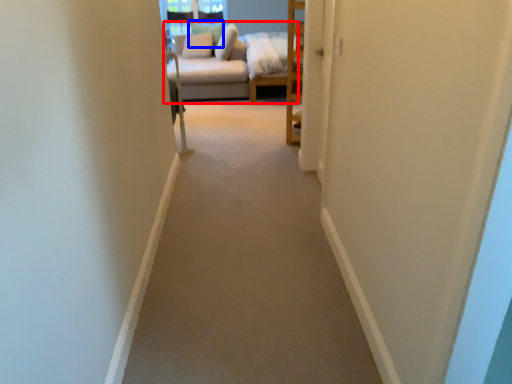
Question: Which object is closer to the camera taking this photo, studio couch (highlighted by a red box) or pillow (highlighted by a blue box)?

Choices:
 (A) studio couch
 (B) pillow

Answer: (A)